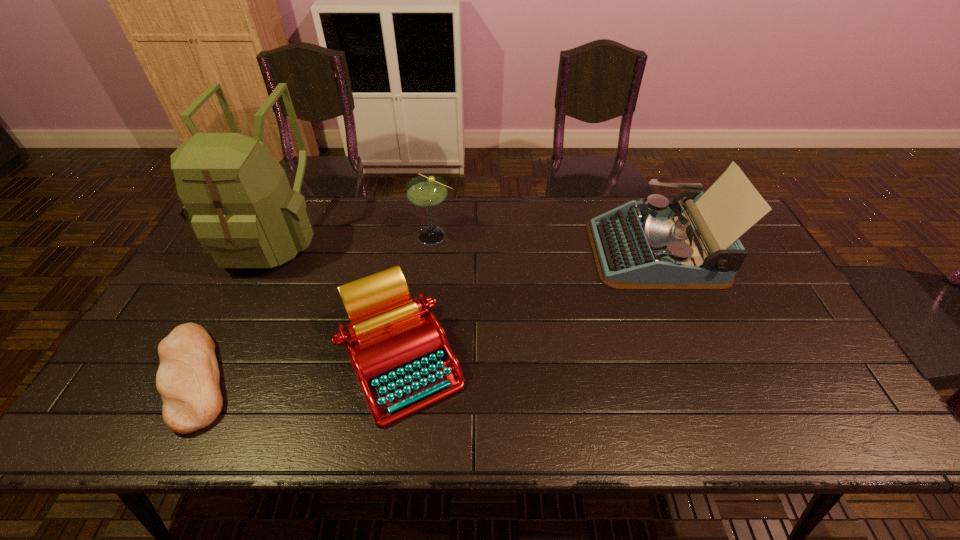
The image size is (960, 540). Identify the location of vacant area that lies between the martini and the backpack. (353, 235).

You are a GUI agent. You are given a task and a screenshot of the screen. Output one action in this format:
    pyautogui.click(x=<x>, y=<y>)
    Task: Click on the unoccupied area between the tallest object and the left typewriter
    The height and width of the screenshot is (540, 960).
    Given the screenshot: What is the action you would take?
    pyautogui.click(x=338, y=299)

The width and height of the screenshot is (960, 540). Find the location of `vacant space in between the fourth tallest object and the tallest object`. vacant space in between the fourth tallest object and the tallest object is located at coordinates (338, 299).

The width and height of the screenshot is (960, 540). Identify the location of empty space between the second tallest object and the martini. (544, 243).

Find the location of a particular element. unoccupied area between the right typewriter and the second shortest object is located at coordinates (529, 306).

Find the location of a particular element. The width and height of the screenshot is (960, 540). empty space that is in between the martini and the shortest object is located at coordinates (315, 307).

Where is `unoccupied position between the backpack and the left typewriter`? This screenshot has height=540, width=960. unoccupied position between the backpack and the left typewriter is located at coordinates (338, 299).

Choose which object is the second nearest neighbor to the tallest object. Please provide its 2D coordinates. Your answer should be formatted as a tuple, i.e. [(x, y)], where the tuple contains the x and y coordinates of a point satisfying the conditions above.

[(398, 349)]

Locate which object ranks second in proximity to the rightmost object. Please provide its 2D coordinates. Your answer should be formatted as a tuple, i.e. [(x, y)], where the tuple contains the x and y coordinates of a point satisfying the conditions above.

[(425, 191)]